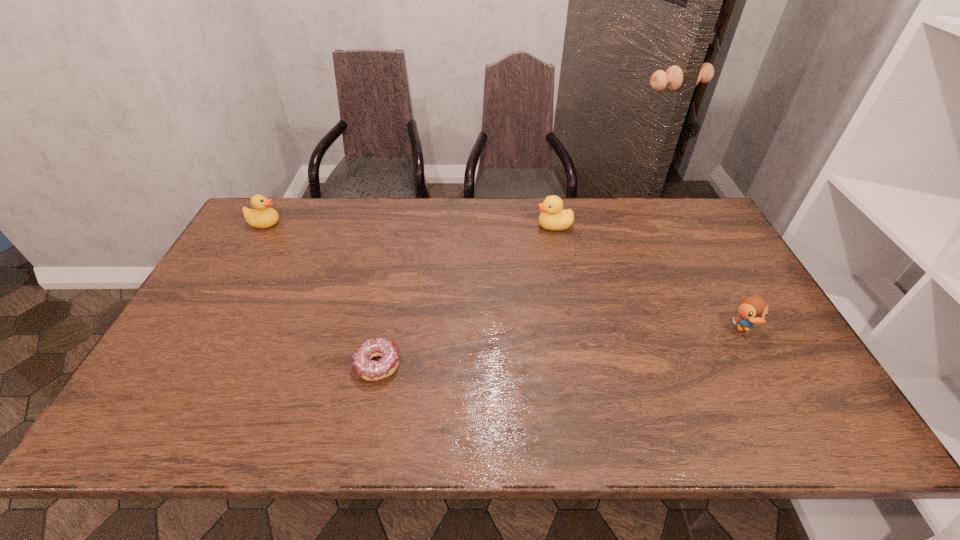
The width and height of the screenshot is (960, 540). Find the location of `the closest object relative to the leftmost object`. the closest object relative to the leftmost object is located at coordinates (372, 370).

Select which object is the second closest to the doughnut. Please provide its 2D coordinates. Your answer should be formatted as a tuple, i.e. [(x, y)], where the tuple contains the x and y coordinates of a point satisfying the conditions above.

[(263, 216)]

Identify which duck is the second closest to the second duck from left to right. Please provide its 2D coordinates. Your answer should be formatted as a tuple, i.e. [(x, y)], where the tuple contains the x and y coordinates of a point satisfying the conditions above.

[(263, 216)]

Where is `duck identified as the closest to the rightmost duck`? The height and width of the screenshot is (540, 960). duck identified as the closest to the rightmost duck is located at coordinates (553, 218).

This screenshot has width=960, height=540. Identify the location of vacant space that satisfies the following two spatial constraints: 1. at the beak of the leftmost duck; 2. on the right side of the third object from right to left. (182, 365).

This screenshot has width=960, height=540. In order to click on vacant space that satisfies the following two spatial constraints: 1. at the beak of the third object from left to right; 2. on the front side of the nearest object in this screenshot , I will do click(582, 365).